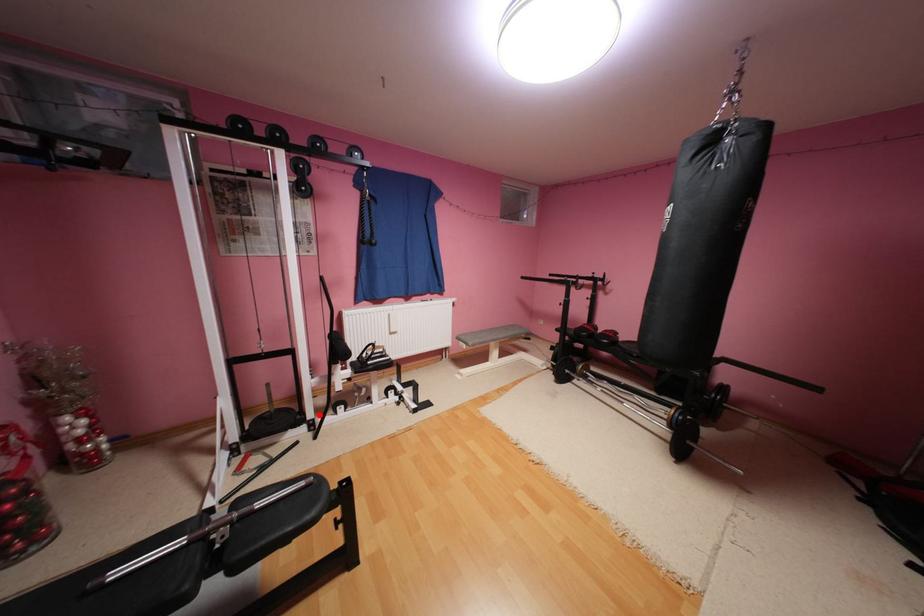
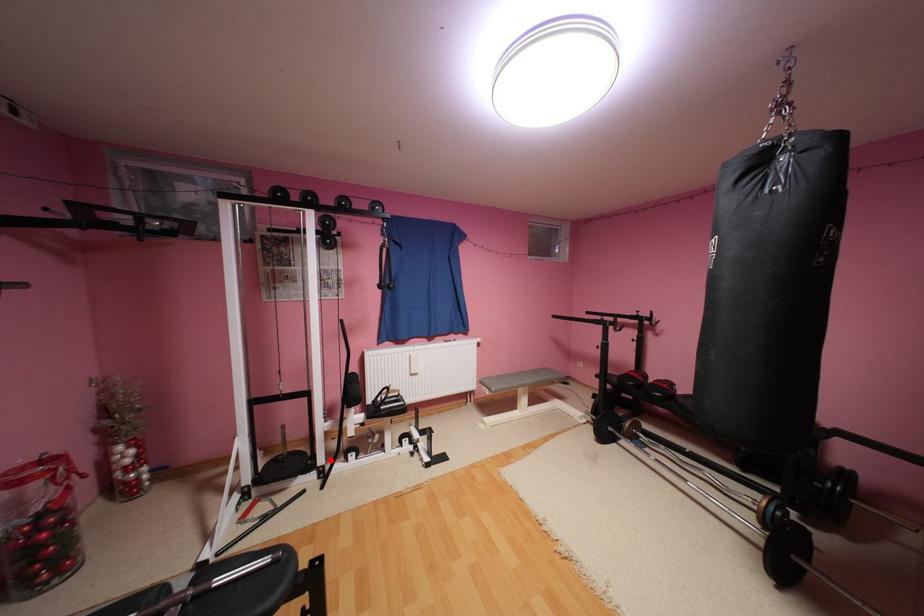
I am providing you with two images of the same scene from different viewpoints. A red point is marked on the first image and another point is marked on the second image. Do the highlighted points in image1 and image2 indicate the same real-world spot?

Yes